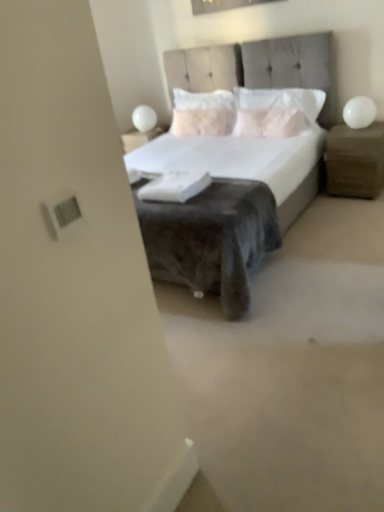
Describe the element at coordinates (144, 118) in the screenshot. Image resolution: width=384 pixels, height=512 pixels. I see `white glossy sphere at upper left, which is the second table lamp from bottom to top` at that location.

Where is `white textured pillow at center, marked as the 1th pillow in a left-to-right arrangement`? Image resolution: width=384 pixels, height=512 pixels. white textured pillow at center, marked as the 1th pillow in a left-to-right arrangement is located at coordinates (203, 113).

Locate an element on the screen. The width and height of the screenshot is (384, 512). white soft pillow at center, acting as the second pillow starting from the left is located at coordinates (276, 111).

Identify the location of white glossy table lamp at upper right, positioned as the 1th table lamp in bottom-to-top order. The image size is (384, 512). (359, 112).

This screenshot has height=512, width=384. What do you see at coordinates (359, 112) in the screenshot?
I see `white glossy table lamp at upper right, the 2th table lamp positioned from the top` at bounding box center [359, 112].

This screenshot has width=384, height=512. What do you see at coordinates (236, 165) in the screenshot?
I see `velvet gray bed at center` at bounding box center [236, 165].

Locate an element on the screen. The width and height of the screenshot is (384, 512). white glossy sphere at upper left, which is the second table lamp from right to left is located at coordinates (144, 118).

Does point (354, 153) lie behind point (168, 157)?

No, (354, 153) is closer to viewer.

Between wooden nightstand at right and velvet gray bed at center, which one has more height?

velvet gray bed at center is taller.

In the image, is wooden nightstand at right on the left side or the right side of velvet gray bed at center?

From the image, it's evident that wooden nightstand at right is to the right of velvet gray bed at center.

The image size is (384, 512). I want to click on bed that is above the wooden nightstand at right (from a real-world perspective), so 236,165.

Which of these two, white textured pillow at center, which is the 2th pillow from right to left, or white glossy table lamp at upper right, which appears as the 1th table lamp when viewed from the front, stands shorter?

Standing shorter between the two is white glossy table lamp at upper right, which appears as the 1th table lamp when viewed from the front.

Choose the correct answer: Is white textured pillow at center, marked as the 1th pillow in a left-to-right arrangement, inside white glossy table lamp at upper right, positioned as the 1th table lamp in bottom-to-top order, or outside it?

white textured pillow at center, marked as the 1th pillow in a left-to-right arrangement, exists outside the volume of white glossy table lamp at upper right, positioned as the 1th table lamp in bottom-to-top order.

From the image's perspective, is white textured pillow at center, which is the 2th pillow from right to left, above or below white glossy table lamp at upper right, acting as the 2th table lamp starting from the left?

From the image's perspective, white textured pillow at center, which is the 2th pillow from right to left, appears above white glossy table lamp at upper right, acting as the 2th table lamp starting from the left.

Is white textured pillow at center, which is the 2th pillow from right to left, in contact with white glossy table lamp at upper right, the second table lamp viewed from the back?

No.

Can you confirm if wooden nightstand at right is positioned to the left of white textured pillow at center, marked as the 1th pillow in a left-to-right arrangement?

Incorrect, wooden nightstand at right is not on the left side of white textured pillow at center, marked as the 1th pillow in a left-to-right arrangement.

Which is farther from the camera, (x=338, y=128) or (x=180, y=104)?

Point (x=180, y=104)

From the image's perspective, relative to white textured pillow at center, which is the 2th pillow from right to left, is wooden nightstand at right above or below?

From the image's perspective, wooden nightstand at right appears below white textured pillow at center, which is the 2th pillow from right to left.

Can you tell me how much white glossy sphere at upper left, positioned as the 1th table lamp in back-to-front order, and white soft pillow at center, the first pillow in the right-to-left sequence, differ in facing direction?

There is a 4.41-degree angle between the facing directions of white glossy sphere at upper left, positioned as the 1th table lamp in back-to-front order, and white soft pillow at center, the first pillow in the right-to-left sequence.

From the image's perspective, between white glossy sphere at upper left, which is counted as the first table lamp, starting from the left, and white soft pillow at center, the first pillow in the right-to-left sequence, who is located below?

white soft pillow at center, the first pillow in the right-to-left sequence.

Considering the positions of point (150, 129) and point (303, 102), is point (150, 129) closer or farther from the camera than point (303, 102)?

Point (150, 129) is farther from the camera than point (303, 102).

Where is `the 2nd pillow below when counting from the white glossy sphere at upper left, which is the second table lamp from bottom to top (from the image's perspective)`? The image size is (384, 512). the 2nd pillow below when counting from the white glossy sphere at upper left, which is the second table lamp from bottom to top (from the image's perspective) is located at coordinates (276, 111).

From a real-world perspective, who is located higher, white soft pillow at center, acting as the second pillow starting from the left, or white glossy sphere at upper left, positioned as the first table lamp in top-to-bottom order?

white soft pillow at center, acting as the second pillow starting from the left, from a real-world perspective.

Does point (279, 126) come closer to viewer compared to point (152, 116)?

Yes, it is in front of point (152, 116).

Is white soft pillow at center, acting as the second pillow starting from the left, turned away from white glossy sphere at upper left, positioned as the 1th table lamp in back-to-front order?

No, white soft pillow at center, acting as the second pillow starting from the left,'s orientation is not away from white glossy sphere at upper left, positioned as the 1th table lamp in back-to-front order.

Considering their positions, is white soft pillow at center, acting as the second pillow starting from the left, located in front of or behind white glossy sphere at upper left, marked as the 2th table lamp in a front-to-back arrangement?

white soft pillow at center, acting as the second pillow starting from the left, is positioned closer to the viewer than white glossy sphere at upper left, marked as the 2th table lamp in a front-to-back arrangement.

This screenshot has width=384, height=512. In order to click on bed that is on the left side of white glossy table lamp at upper right, acting as the 2th table lamp starting from the left in this screenshot , I will do `click(236, 165)`.

From a real-world perspective, is white glossy table lamp at upper right, the 2th table lamp positioned from the top, positioned under velvet gray bed at center based on gravity?

No.

In terms of width, does white glossy table lamp at upper right, the second table lamp viewed from the back, look wider or thinner when compared to velvet gray bed at center?

white glossy table lamp at upper right, the second table lamp viewed from the back, is thinner than velvet gray bed at center.

In the scene shown: From the image's perspective, is white glossy table lamp at upper right, the 2th table lamp positioned from the top, on top of velvet gray bed at center?

Yes, from the image's perspective, white glossy table lamp at upper right, the 2th table lamp positioned from the top, is above velvet gray bed at center.

Can you confirm if velvet gray bed at center is bigger than wooden nightstand at right?

Indeed, velvet gray bed at center has a larger size compared to wooden nightstand at right.

Find the location of a particular element. Image resolution: width=384 pixels, height=512 pixels. nightstand that is behind the velvet gray bed at center is located at coordinates (355, 161).

Can you tell me how much velvet gray bed at center and wooden nightstand at right differ in facing direction?

The angular difference between velvet gray bed at center and wooden nightstand at right is 2.12 degrees.

Is velvet gray bed at center surrounding wooden nightstand at right?

No, wooden nightstand at right is not surrounded by velvet gray bed at center.

In the image, there is a velvet gray bed at center. In order to click on nightstand below it (from the image's perspective) in this screenshot , I will do `click(355, 161)`.

Where is `the 2nd pillow behind the white glossy table lamp at upper right, acting as the 2th table lamp starting from the left`? the 2nd pillow behind the white glossy table lamp at upper right, acting as the 2th table lamp starting from the left is located at coordinates (203, 113).

Based on their spatial positions, is white glossy table lamp at upper right, the second table lamp viewed from the back, or white glossy sphere at upper left, positioned as the 1th table lamp in back-to-front order, closer to velvet gray bed at center?

Based on the image, white glossy table lamp at upper right, the second table lamp viewed from the back, appears to be nearer to velvet gray bed at center.

Considering their positions, is white glossy sphere at upper left, marked as the 2th table lamp in a front-to-back arrangement, positioned closer to white glossy table lamp at upper right, the second table lamp viewed from the back, than white textured pillow at center, marked as the 1th pillow in a left-to-right arrangement?

Based on the image, white textured pillow at center, marked as the 1th pillow in a left-to-right arrangement, appears to be nearer to white glossy table lamp at upper right, the second table lamp viewed from the back.

When comparing their distances from white glossy table lamp at upper right, acting as the 2th table lamp starting from the left, does velvet gray bed at center or white soft pillow at center, the first pillow in the right-to-left sequence, seem closer?

white soft pillow at center, the first pillow in the right-to-left sequence, is closer to white glossy table lamp at upper right, acting as the 2th table lamp starting from the left.

When comparing their distances from white textured pillow at center, which is the 2th pillow from right to left, does wooden nightstand at right or white glossy table lamp at upper right, the second table lamp viewed from the back, seem closer?

Based on the image, wooden nightstand at right appears to be nearer to white textured pillow at center, which is the 2th pillow from right to left.

From the image, which object appears to be nearer to velvet gray bed at center, white glossy sphere at upper left, positioned as the first table lamp in top-to-bottom order, or wooden nightstand at right?

wooden nightstand at right.

From the image, which object appears to be farther from white soft pillow at center, acting as the second pillow starting from the left, velvet gray bed at center or white textured pillow at center, marked as the 1th pillow in a left-to-right arrangement?

white textured pillow at center, marked as the 1th pillow in a left-to-right arrangement, lies further to white soft pillow at center, acting as the second pillow starting from the left, than the other object.

Which object lies further to the anchor point wooden nightstand at right, white soft pillow at center, the first pillow in the right-to-left sequence, or white glossy sphere at upper left, positioned as the 1th table lamp in back-to-front order?

Based on the image, white glossy sphere at upper left, positioned as the 1th table lamp in back-to-front order, appears to be further to wooden nightstand at right.

Considering their positions, is wooden nightstand at right positioned further to white glossy sphere at upper left, which is the second table lamp from right to left, than white soft pillow at center, acting as the second pillow starting from the left?

The object further to white glossy sphere at upper left, which is the second table lamp from right to left, is wooden nightstand at right.

In order to click on pillow located between white glossy sphere at upper left, which is the second table lamp from right to left, and white soft pillow at center, the first pillow in the right-to-left sequence, in the left-right direction in this screenshot , I will do `click(203, 113)`.

This screenshot has width=384, height=512. In order to click on nightstand located between velvet gray bed at center and white glossy sphere at upper left, which is the second table lamp from bottom to top, in the depth direction in this screenshot , I will do `click(355, 161)`.

Image resolution: width=384 pixels, height=512 pixels. What are the coordinates of `table lamp located between velvet gray bed at center and wooden nightstand at right in the left-right direction` in the screenshot? It's located at (359, 112).

Where is `pillow located between white textured pillow at center, marked as the 1th pillow in a left-to-right arrangement, and wooden nightstand at right in the left-right direction`? Image resolution: width=384 pixels, height=512 pixels. pillow located between white textured pillow at center, marked as the 1th pillow in a left-to-right arrangement, and wooden nightstand at right in the left-right direction is located at coordinates (276, 111).